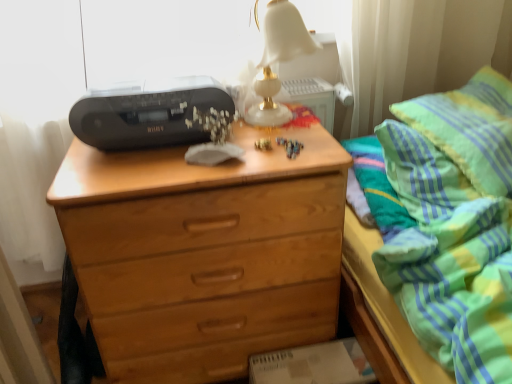
Question: Is black plastic printer at upper left located outside white marble table lamp at upper center?

Choices:
 (A) no
 (B) yes

Answer: (B)

Question: Are black plastic printer at upper left and white marble table lamp at upper center located far from each other?

Choices:
 (A) yes
 (B) no

Answer: (B)

Question: Is black plastic printer at upper left turned away from white marble table lamp at upper center?

Choices:
 (A) no
 (B) yes

Answer: (A)

Question: Is the position of black plastic printer at upper left less distant than that of white marble table lamp at upper center?

Choices:
 (A) no
 (B) yes

Answer: (A)

Question: Can you confirm if black plastic printer at upper left is shorter than white marble table lamp at upper center?

Choices:
 (A) no
 (B) yes

Answer: (B)

Question: Considering their positions, is green striped fabric at upper right located in front of or behind white marble table lamp at upper center?

Choices:
 (A) behind
 (B) front

Answer: (B)

Question: Considering the relative positions of green striped fabric at upper right and white marble table lamp at upper center in the image provided, is green striped fabric at upper right to the left or to the right of white marble table lamp at upper center?

Choices:
 (A) right
 (B) left

Answer: (A)

Question: Is green striped fabric at upper right situated inside white marble table lamp at upper center or outside?

Choices:
 (A) inside
 (B) outside

Answer: (B)

Question: Does point (458, 139) appear closer or farther from the camera than point (269, 56)?

Choices:
 (A) farther
 (B) closer

Answer: (B)

Question: In terms of height, does green striped fabric at upper right look taller or shorter compared to light brown wood chest of drawers at center?

Choices:
 (A) tall
 (B) short

Answer: (A)

Question: Is green striped fabric at upper right in front of or behind light brown wood chest of drawers at center in the image?

Choices:
 (A) behind
 (B) front

Answer: (B)

Question: From a real-world perspective, is green striped fabric at upper right physically located above or below light brown wood chest of drawers at center?

Choices:
 (A) above
 (B) below

Answer: (A)

Question: Considering the positions of green striped fabric at upper right and light brown wood chest of drawers at center in the image, is green striped fabric at upper right wider or thinner than light brown wood chest of drawers at center?

Choices:
 (A) thin
 (B) wide

Answer: (B)

Question: From the image's perspective, is white marble table lamp at upper center located above or below green striped pillow at upper right?

Choices:
 (A) below
 (B) above

Answer: (B)

Question: In terms of width, does white marble table lamp at upper center look wider or thinner when compared to green striped pillow at upper right?

Choices:
 (A) wide
 (B) thin

Answer: (B)